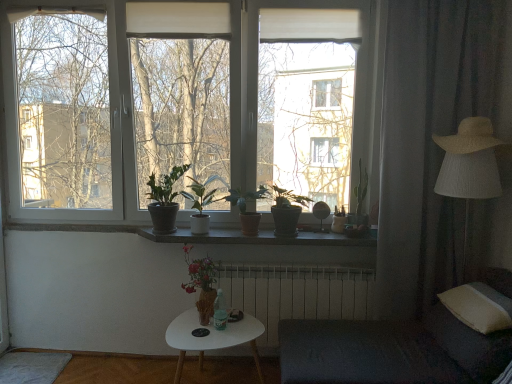
Find the location of a particular element. The height and width of the screenshot is (384, 512). vacant point above white matte coffee table at lower center (from a real-world perspective) is located at coordinates (218, 329).